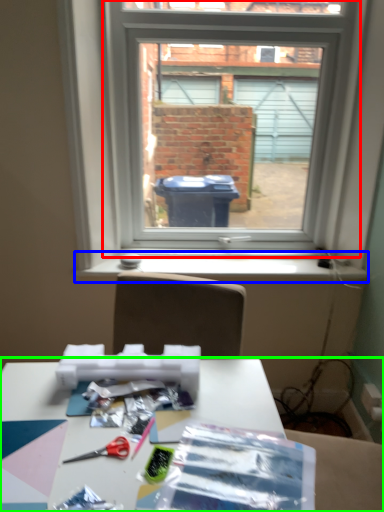
Question: Estimate the real-world distances between objects in this image. Which object is closer to window (highlighted by a red box), window sill (highlighted by a blue box) or table (highlighted by a green box)?

Choices:
 (A) window sill
 (B) table

Answer: (A)